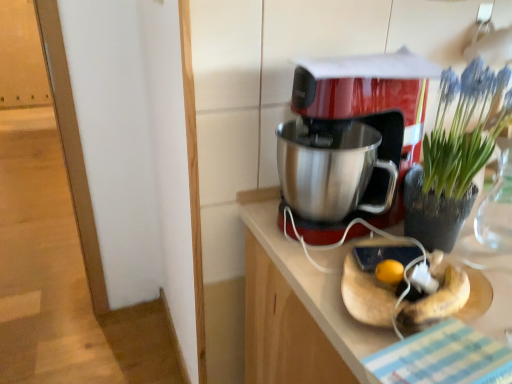
Question: From the image's perspective, is stainless steel countertop at center under metallic red coffee maker at center?

Choices:
 (A) yes
 (B) no

Answer: (A)

Question: Considering the relative positions of stainless steel countertop at center and metallic red coffee maker at center in the image provided, is stainless steel countertop at center to the right of metallic red coffee maker at center from the viewer's perspective?

Choices:
 (A) no
 (B) yes

Answer: (B)

Question: From the image's perspective, would you say stainless steel countertop at center is positioned over metallic red coffee maker at center?

Choices:
 (A) yes
 (B) no

Answer: (B)

Question: Is stainless steel countertop at center positioned far away from metallic red coffee maker at center?

Choices:
 (A) yes
 (B) no

Answer: (B)

Question: From a real-world perspective, does stainless steel countertop at center sit lower than metallic red coffee maker at center?

Choices:
 (A) yes
 (B) no

Answer: (A)

Question: Is stainless steel countertop at center further to camera compared to metallic red coffee maker at center?

Choices:
 (A) no
 (B) yes

Answer: (A)

Question: From the image's perspective, is green leafy plant at upper right located beneath metallic red coffee maker at center?

Choices:
 (A) yes
 (B) no

Answer: (A)

Question: Is green leafy plant at upper right positioned with its back to metallic red coffee maker at center?

Choices:
 (A) yes
 (B) no

Answer: (A)

Question: Considering the relative sizes of green leafy plant at upper right and metallic red coffee maker at center in the image provided, is green leafy plant at upper right taller than metallic red coffee maker at center?

Choices:
 (A) no
 (B) yes

Answer: (B)

Question: Would you say green leafy plant at upper right is outside metallic red coffee maker at center?

Choices:
 (A) no
 (B) yes

Answer: (B)

Question: Considering the relative positions of green leafy plant at upper right and metallic red coffee maker at center in the image provided, is green leafy plant at upper right to the right of metallic red coffee maker at center from the viewer's perspective?

Choices:
 (A) yes
 (B) no

Answer: (A)

Question: From a real-world perspective, is green leafy plant at upper right below metallic red coffee maker at center?

Choices:
 (A) no
 (B) yes

Answer: (A)

Question: From a real-world perspective, is metallic red coffee maker at center below stainless steel countertop at center?

Choices:
 (A) no
 (B) yes

Answer: (A)